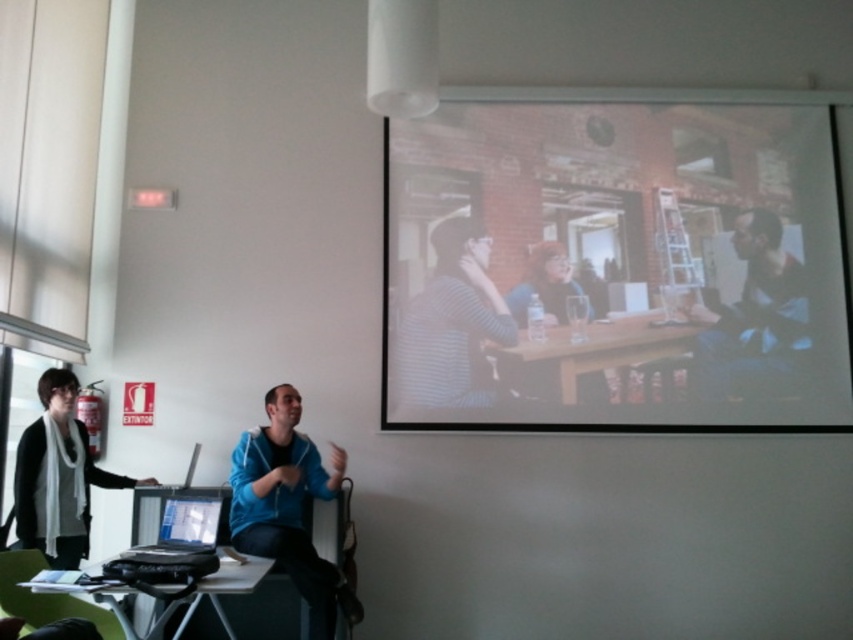
You are organizing a small event and need to decide whether to place a decorative item on the white scarf at left or the black plastic table at lower left. Based on their sizes, which surface can accommodate a larger decorative item?

The black plastic table at lower left is larger than the white scarf at left, so it can accommodate a larger decorative item.

You are standing in the room and want to take a photo of the point at coordinates (311, 579). The camera you are using has a minimum focus distance of 3 meters. Will the camera be able to focus on the point?

The point at coordinates (311, 579) is 3.24 meters from the camera, which is beyond the minimum focus distance of 3 meters. Therefore, the camera should be able to focus on the point.